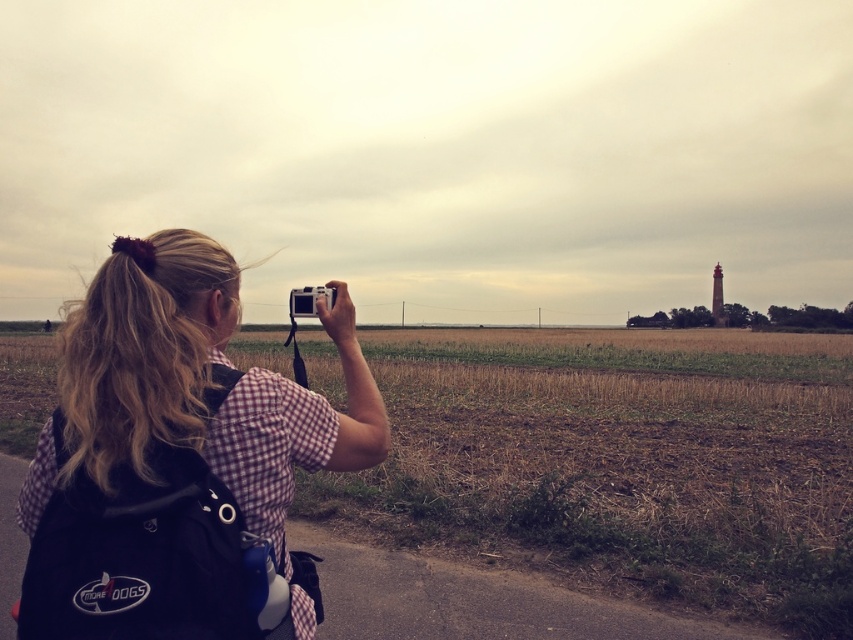
You are a photographer trying to capture a clear shot of the landscape. You notice the checkered fabric shirt at center and the silver metallic camera at upper center. Which object is closer to the camera lens? Please explain based on their positions.

The silver metallic camera at upper center is closer to the camera lens since it is positioned higher than the checkered fabric shirt at center.

You are standing at the point with coordinates closest to the center of the image. You want to move towards the point labeled point (32, 444). Which direction should you move relative to the point labeled point (224, 589)?

Since point (32, 444) is closer to you than point (224, 589), you should move towards the direction that is closer to your current position relative to point (224, 589).